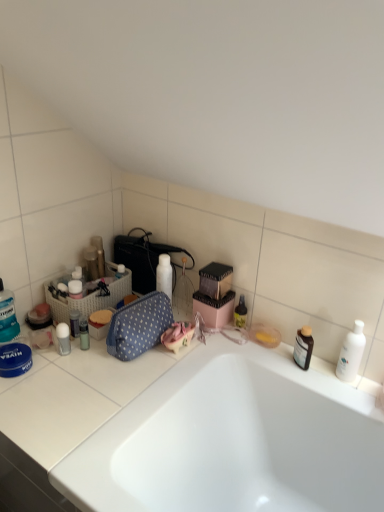
You are a GUI agent. You are given a task and a screenshot of the screen. Output one action in this format:
    pyautogui.click(x=<x>, y=<y>)
    Task: Click on the free spot in front of white glossy bottle at right, which is the 10th toiletry in left-to-right order
    
    Given the screenshot: What is the action you would take?
    pyautogui.click(x=349, y=397)